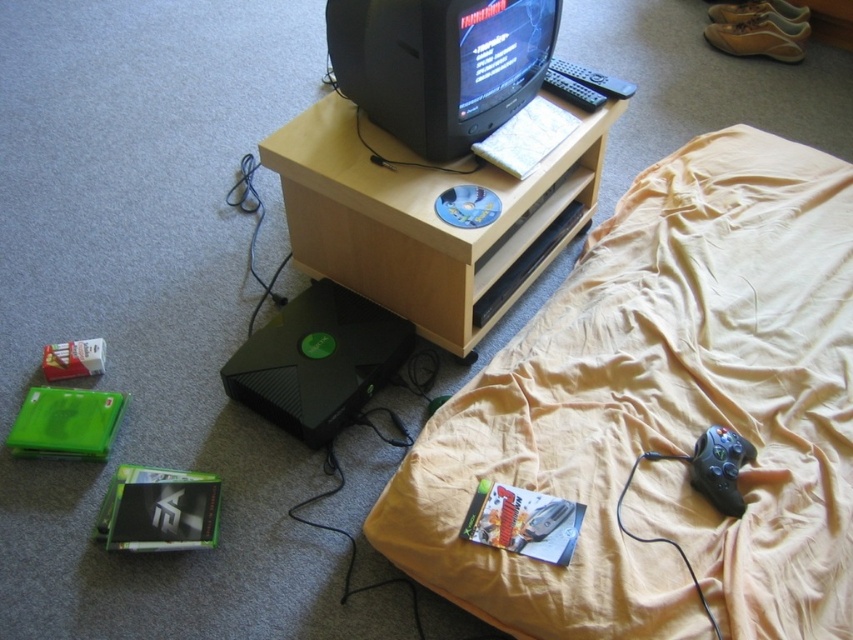
Question: Which point is closer to the camera taking this photo?

Choices:
 (A) (358, 131)
 (B) (805, 369)

Answer: (B)

Question: Is wooden table at center smaller than black plastic remote at upper center?

Choices:
 (A) yes
 (B) no

Answer: (B)

Question: Can you confirm if beige fabric bed at upper right is positioned to the right of black plastic remote at upper center?

Choices:
 (A) no
 (B) yes

Answer: (B)

Question: Does wooden table at center appear on the right side of black plastic remote at upper center?

Choices:
 (A) no
 (B) yes

Answer: (A)

Question: Which of the following is the farthest from the observer?

Choices:
 (A) (329, 220)
 (B) (634, 90)

Answer: (B)

Question: Which object is positioned closest to the wooden table at center?

Choices:
 (A) black plastic remote at upper center
 (B) beige fabric bed at upper right

Answer: (B)